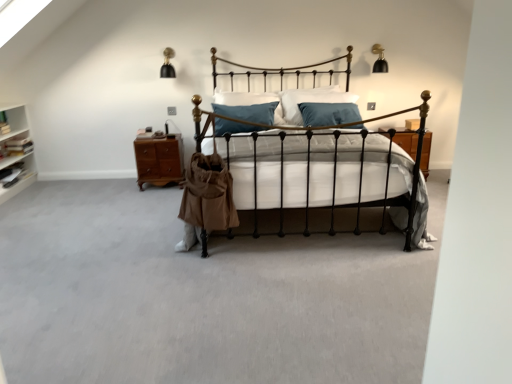
Question: Is black wrought iron bed at center to the right of blue velvet pillow at center from the viewer's perspective?

Choices:
 (A) no
 (B) yes

Answer: (B)

Question: Considering the relative positions of black wrought iron bed at center and blue velvet pillow at center in the image provided, is black wrought iron bed at center to the left of blue velvet pillow at center from the viewer's perspective?

Choices:
 (A) yes
 (B) no

Answer: (B)

Question: Is black wrought iron bed at center looking in the opposite direction of blue velvet pillow at center?

Choices:
 (A) yes
 (B) no

Answer: (A)

Question: From a real-world perspective, is black wrought iron bed at center on top of blue velvet pillow at center?

Choices:
 (A) no
 (B) yes

Answer: (A)

Question: Would you say black wrought iron bed at center is a long distance from blue velvet pillow at center?

Choices:
 (A) no
 (B) yes

Answer: (B)

Question: Is black wrought iron bed at center located outside blue velvet pillow at center?

Choices:
 (A) yes
 (B) no

Answer: (A)

Question: Can you confirm if blue velvet pillow at center is positioned to the left of black wrought iron bed at center?

Choices:
 (A) no
 (B) yes

Answer: (B)

Question: Is blue velvet pillow at center positioned with its back to black wrought iron bed at center?

Choices:
 (A) yes
 (B) no

Answer: (B)

Question: Is blue velvet pillow at center in contact with black wrought iron bed at center?

Choices:
 (A) yes
 (B) no

Answer: (B)

Question: Is blue velvet pillow at center not within black wrought iron bed at center?

Choices:
 (A) no
 (B) yes

Answer: (B)

Question: From the image's perspective, is blue velvet pillow at center under black wrought iron bed at center?

Choices:
 (A) yes
 (B) no

Answer: (B)

Question: Can you confirm if blue velvet pillow at center is thinner than black wrought iron bed at center?

Choices:
 (A) no
 (B) yes

Answer: (B)

Question: Can you confirm if brown wood nightstand at left is thinner than blue velvet pillow at center?

Choices:
 (A) no
 (B) yes

Answer: (A)